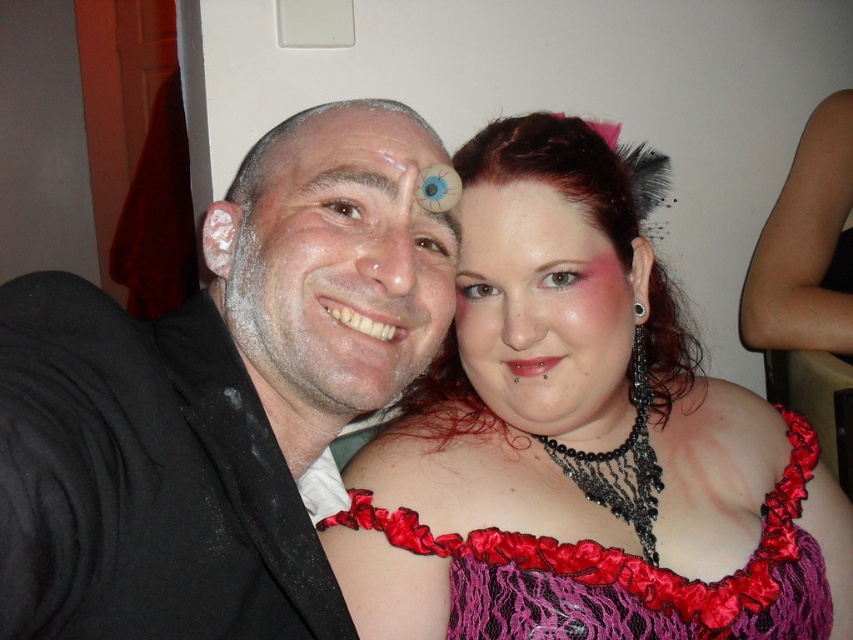
Question: Estimate the real-world distances between objects in this image. Which object is closer to the pink matte makeup at center?

Choices:
 (A) matte skin forehead at upper center
 (B) matte red lace dress at center
 (C) matte white face at center

Answer: (B)

Question: Among these points, which one is nearest to the camera?

Choices:
 (A) (352, 108)
 (B) (375, 186)
 (C) (259, 237)

Answer: (B)

Question: Can you confirm if matte red lace dress at center is positioned above brown hair at upper center?

Choices:
 (A) no
 (B) yes

Answer: (A)

Question: Among these objects, which one is nearest to the camera?

Choices:
 (A) silky satin dress at center
 (B) matte black suit at left
 (C) pink matte makeup at center

Answer: (B)

Question: Is matte black suit at left thinner than matte white face at center?

Choices:
 (A) yes
 (B) no

Answer: (B)

Question: Does silky satin dress at center have a larger size compared to matte skin forehead at upper center?

Choices:
 (A) no
 (B) yes

Answer: (B)